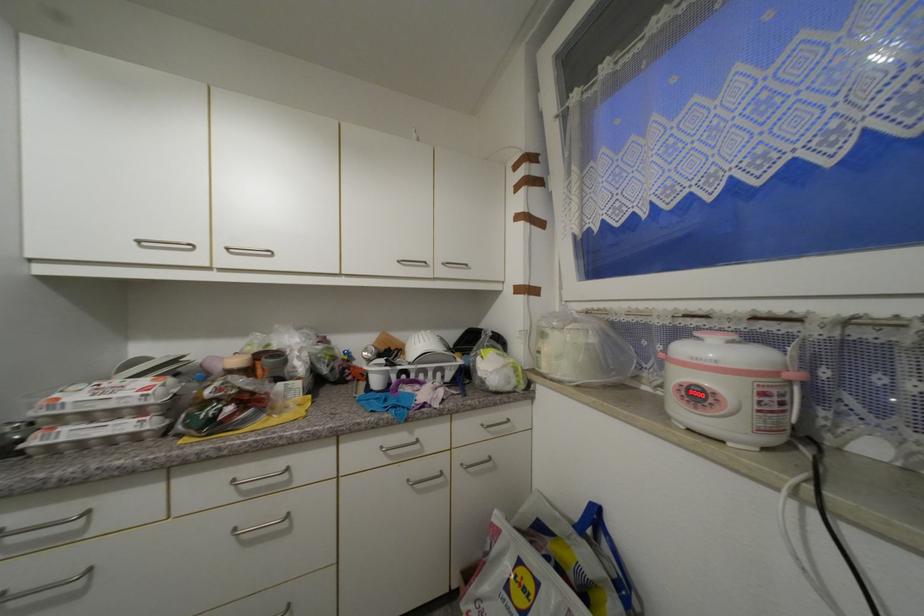
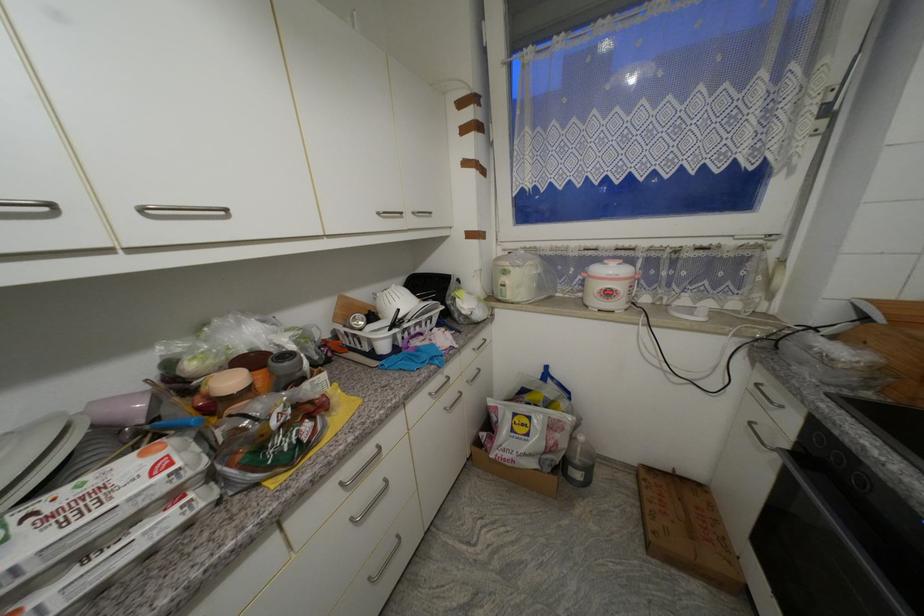
The point at [238,483] is marked in the first image. Where is the corresponding point in the second image?

(347, 485)